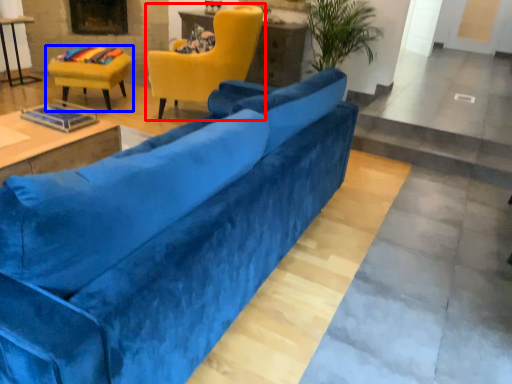
Question: Which point is further to the camera, chair (highlighted by a red box) or chair (highlighted by a blue box)?

Choices:
 (A) chair
 (B) chair

Answer: (B)